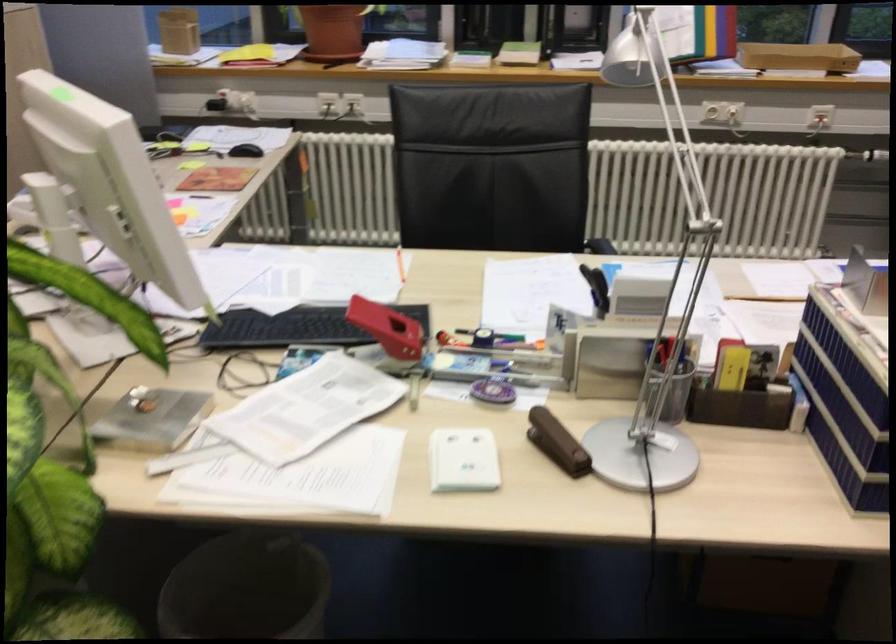
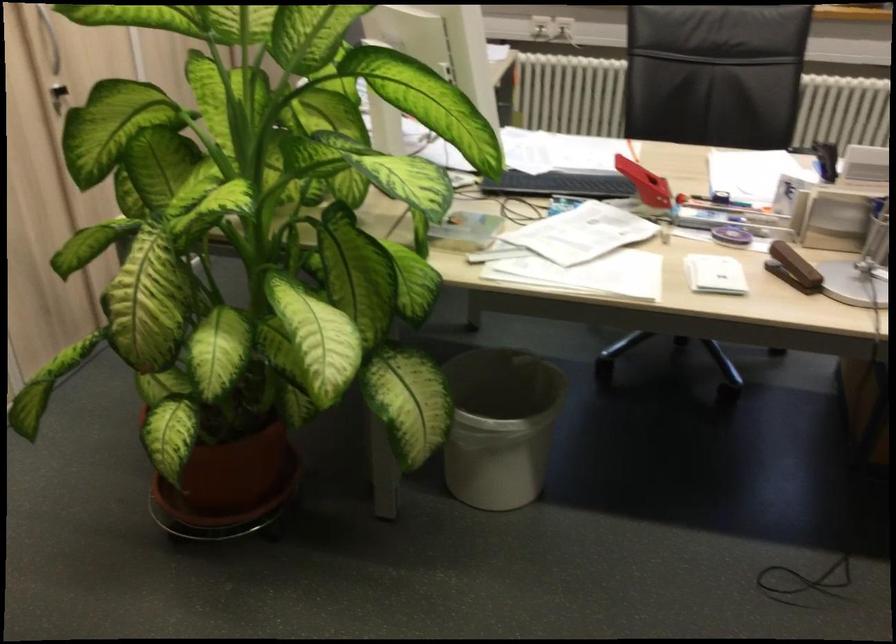
Where in the second image is the point corresponding to pixel 454 272 from the first image?

(676, 158)